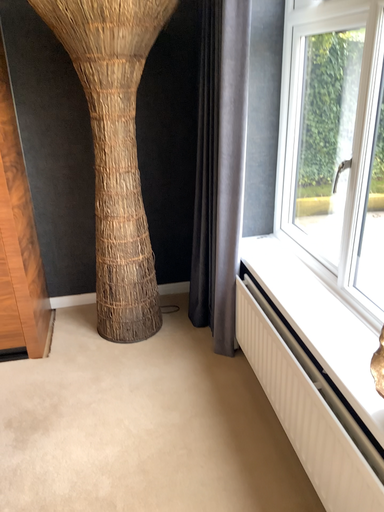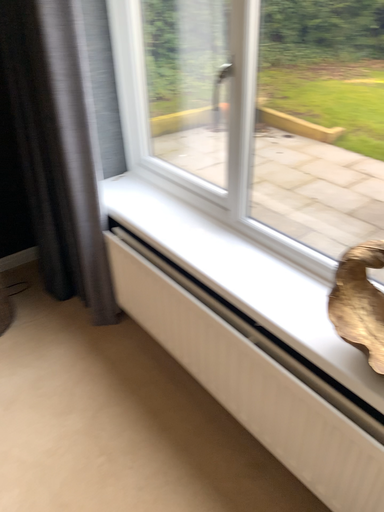
Question: Which way did the camera rotate in the video?

Choices:
 (A) rotated downward
 (B) rotated upward

Answer: (A)